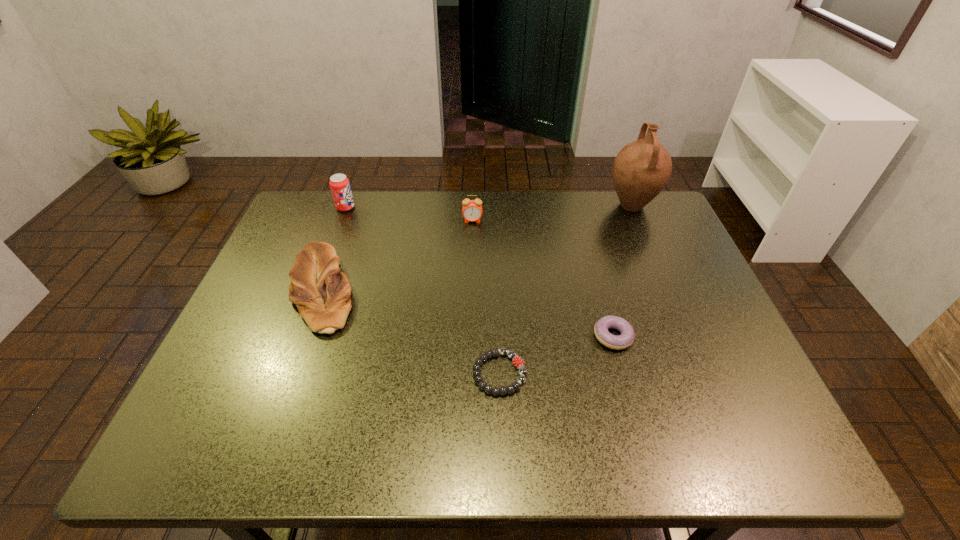
At what (x,y) coordinates should I click in order to perform the action: click on free spot located on the face of the fourth shortest object. Please return your answer as a coordinate pair (x, y). The height and width of the screenshot is (540, 960). Looking at the image, I should click on (471, 273).

What are the coordinates of `free location located 0.260m on the front of the bread` in the screenshot? It's located at (270, 443).

Identify the location of vacant space situated on the back of the fifth tallest object. (598, 284).

Locate an element on the screen. This screenshot has height=540, width=960. free point located on the back of the bracelet is located at coordinates (495, 253).

Locate an element on the screen. pitcher at the far edge is located at coordinates (642, 168).

You are a GUI agent. You are given a task and a screenshot of the screen. Output one action in this format:
    pyautogui.click(x=<x>, y=<y>)
    Task: Click on the soda can present at the far edge
    The image size is (960, 540).
    Given the screenshot: What is the action you would take?
    pyautogui.click(x=340, y=187)

Where is `alarm clock that is at the far edge`? alarm clock that is at the far edge is located at coordinates (472, 209).

Locate an element on the screen. The image size is (960, 540). soda can positioned at the left edge is located at coordinates (340, 187).

Where is `bread present at the left edge`? bread present at the left edge is located at coordinates (321, 292).

Identify the location of object present at the right edge. The height and width of the screenshot is (540, 960). (642, 168).